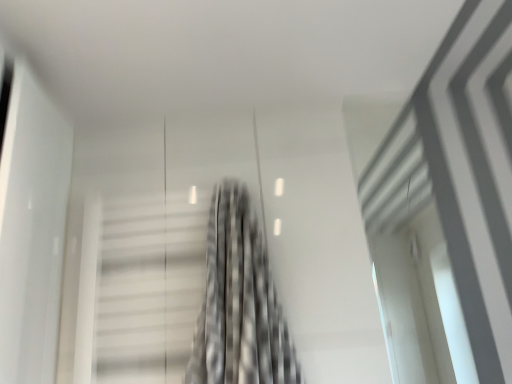
Image resolution: width=512 pixels, height=384 pixels. What do you see at coordinates (150, 289) in the screenshot?
I see `metallic staircase at center` at bounding box center [150, 289].

The width and height of the screenshot is (512, 384). What are the coordinates of `metallic staircase at center` in the screenshot? It's located at (150, 289).

Describe the element at coordinates (239, 303) in the screenshot. I see `black textured curtain at center` at that location.

Where is `black textured curtain at center`? black textured curtain at center is located at coordinates (239, 303).

Find the location of `metallic staircase at center`. metallic staircase at center is located at coordinates (150, 289).

Is metallic staircase at center to the left or to the right of black textured curtain at center in the image?

Based on their positions, metallic staircase at center is located to the left of black textured curtain at center.

Is metallic staircase at center in front of black textured curtain at center?

No, the depth of metallic staircase at center is greater than that of black textured curtain at center.

Is point (121, 347) closer to viewer compared to point (233, 359)?

That is False.

From the image's perspective, is metallic staircase at center positioned above or below black textured curtain at center?

Clearly, from the image's perspective, metallic staircase at center is below black textured curtain at center.

From a real-world perspective, which is physically below, metallic staircase at center or black textured curtain at center?

From a 3D spatial view, black textured curtain at center is below.

Is metallic staircase at center thinner than black textured curtain at center?

Yes.

Is metallic staircase at center taller than black textured curtain at center?

No.

Between metallic staircase at center and black textured curtain at center, which one has larger size?

Bigger between the two is black textured curtain at center.

Can we say metallic staircase at center lies outside black textured curtain at center?

metallic staircase at center lies outside black textured curtain at center's area.

Is metallic staircase at center placed right next to black textured curtain at center?

No, metallic staircase at center is not with black textured curtain at center.

Could you tell me if metallic staircase at center is turned towards black textured curtain at center?

No, metallic staircase at center is not aimed at black textured curtain at center.

How many degrees apart are the facing directions of metallic staircase at center and black textured curtain at center?

metallic staircase at center and black textured curtain at center are facing 0.000893 degrees away from each other.

Measure the distance between metallic staircase at center and black textured curtain at center.

5.91 inches.

What are the coordinates of `curtain above the metallic staircase at center (from the image's perspective)` in the screenshot? It's located at (239, 303).

In the image, is black textured curtain at center on the left side or the right side of metallic staircase at center?

From the image, it's evident that black textured curtain at center is to the right of metallic staircase at center.

Considering the relative positions of black textured curtain at center and metallic staircase at center in the image provided, is black textured curtain at center behind metallic staircase at center?

No, black textured curtain at center is closer to the camera.

Considering the positions of point (244, 306) and point (162, 238), is point (244, 306) closer or farther from the camera than point (162, 238)?

Point (244, 306) is positioned closer to the camera compared to point (162, 238).

From the image's perspective, would you say black textured curtain at center is positioned over metallic staircase at center?

Indeed, from the image's perspective, black textured curtain at center is shown above metallic staircase at center.

From a real-world perspective, which object stands above the other?

metallic staircase at center, from a real-world perspective.

Considering the sizes of objects black textured curtain at center and metallic staircase at center in the image provided, who is thinner, black textured curtain at center or metallic staircase at center?

Thinner between the two is metallic staircase at center.

Does black textured curtain at center have a greater height compared to metallic staircase at center?

Yes.

Is black textured curtain at center bigger than metallic staircase at center?

Yes.

Choose the correct answer: Is black textured curtain at center inside metallic staircase at center or outside it?

black textured curtain at center is located beyond the bounds of metallic staircase at center.

Consider the image. Is there a large distance between black textured curtain at center and metallic staircase at center?

They are positioned close to each other.

Could you tell me if black textured curtain at center is turned towards metallic staircase at center?

No, black textured curtain at center is not facing towards metallic staircase at center.

How different are the orientations of black textured curtain at center and metallic staircase at center in degrees?

They differ by 0.000893 degrees in their facing directions.

At what (x,y) coordinates should I click in order to perform the action: click on curtain that is on the right side of metallic staircase at center. Please return your answer as a coordinate pair (x, y). This screenshot has width=512, height=384. Looking at the image, I should click on (239, 303).

Where is `stairs on the left of black textured curtain at center`? Image resolution: width=512 pixels, height=384 pixels. stairs on the left of black textured curtain at center is located at coordinates (150, 289).

At what (x,y) coordinates should I click in order to perform the action: click on stairs positioned vertically above the black textured curtain at center (from a real-world perspective). Please return your answer as a coordinate pair (x, y). Looking at the image, I should click on (150, 289).